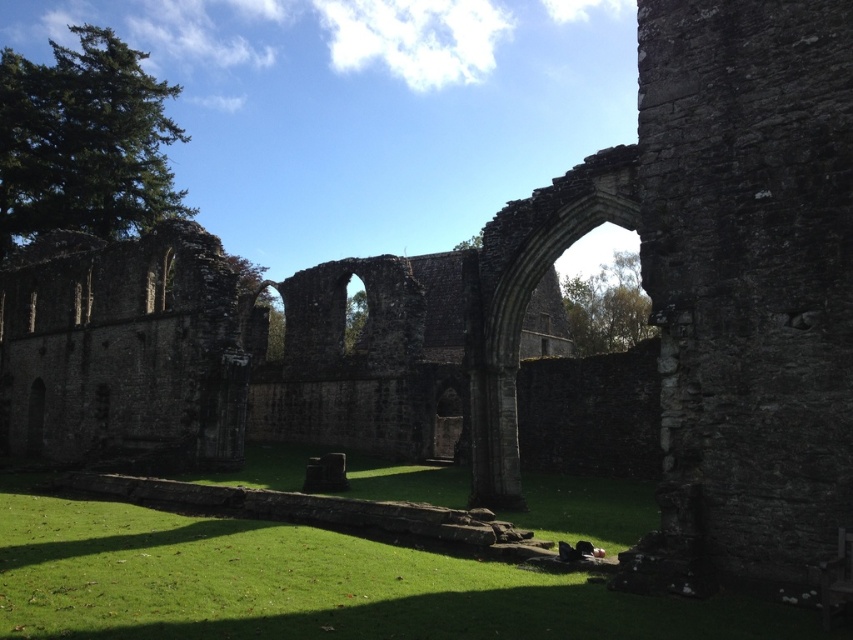
You are a gardener planning to mow the green grass at lower center and the stone archway at center. Which object will require less time to mow?

The green grass at lower center will require less time to mow because it is shorter than the stone archway at center.

You are a photographer planning to capture the stone archway at center and the green grass at lower center in a single shot. Which object will occupy more space in the photo?

The stone archway at center will occupy more space in the photo because the green grass at lower center is smaller than the stone archway at center according to the description.

You are standing in the courtyard of the ruins and want to place a small garden ornament exactly halfway between the green grass at lower center and the stone archway at center. Which object will the ornament be closer to?

The ornament will be closer to the green grass at lower center because it is closer to the viewer than the stone archway at center.